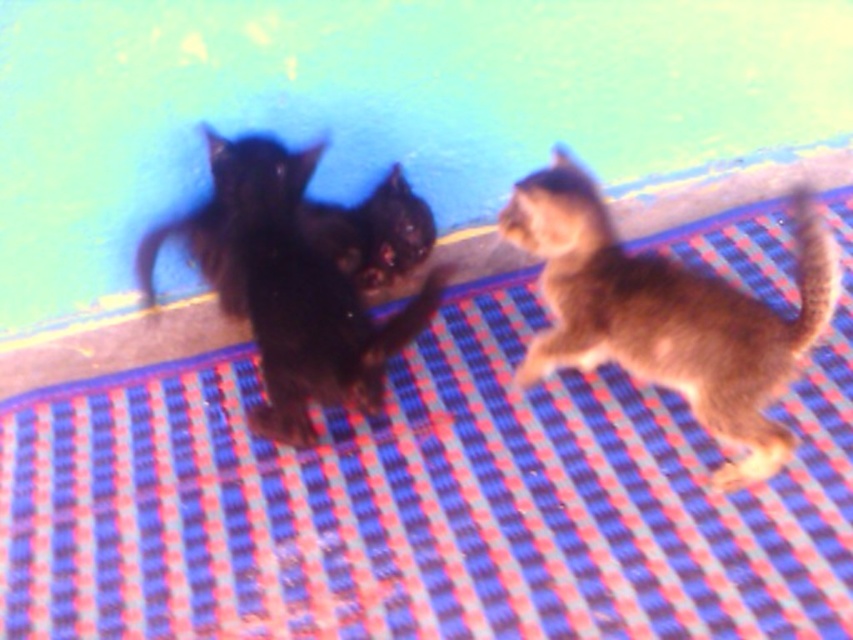
Question: Can you confirm if fuzzy brown cat at center is positioned to the left of shiny black kitten at center?

Choices:
 (A) no
 (B) yes

Answer: (A)

Question: Which object is farther from the camera taking this photo?

Choices:
 (A) shiny black kitten at center
 (B) fuzzy brown cat at center

Answer: (A)

Question: Is blue checkered mat at center further to the viewer compared to fuzzy brown cat at center?

Choices:
 (A) yes
 (B) no

Answer: (B)

Question: Among these objects, which one is farthest from the camera?

Choices:
 (A) blue checkered mat at center
 (B) fuzzy brown cat at center
 (C) shiny black kitten at center

Answer: (C)

Question: Does fuzzy brown cat at center appear over shiny black kitten at center?

Choices:
 (A) yes
 (B) no

Answer: (B)

Question: Which of these objects is positioned closest to the shiny black kitten at center?

Choices:
 (A) blue checkered mat at center
 (B) fuzzy brown cat at center

Answer: (A)